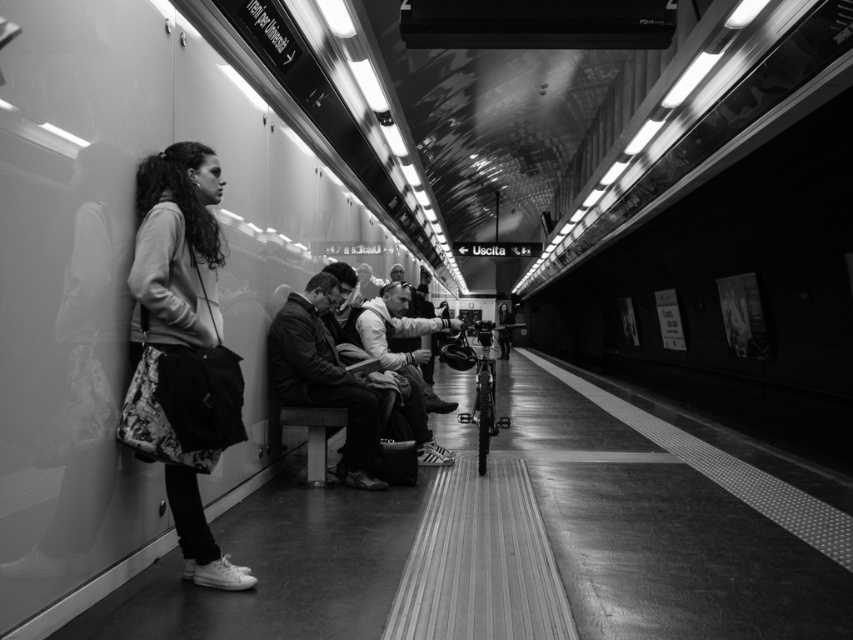
You are a fashion designer observing the subway station scene. You notice two items of clothing in the image. The first is the floral skirt at left and the second is the leather jacket at center. Which of these two items is narrower in width?

The floral skirt at left is narrower in width than the leather jacket at center.

You are a photographer positioned at the end of the subway platform. You want to take a photo that includes both the floral skirt at left and the white cotton shirt at center. Which object should you focus on first if you want to ensure both are in frame?

The floral skirt at left is taller than the white cotton shirt at center, so you should focus on the floral skirt at left first to ensure both are in frame.

Looking at this image, you are a person standing on the subway platform and you see the leather jacket at center and the white cotton shirt at center. Which clothing item is closer to your feet?

The leather jacket at center is located below the white cotton shirt at center, so the leather jacket at center is closer to your feet.